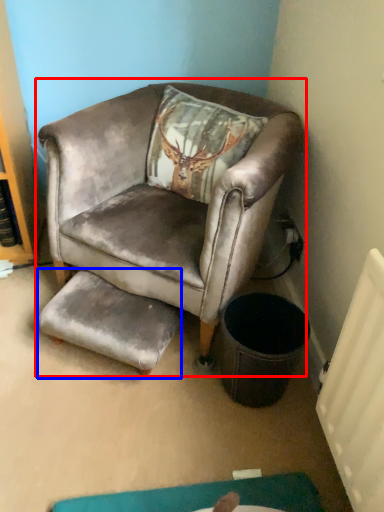
Question: Among these objects, which one is farthest to the camera, chair (highlighted by a red box) or footrest (highlighted by a blue box)?

Choices:
 (A) chair
 (B) footrest

Answer: (B)